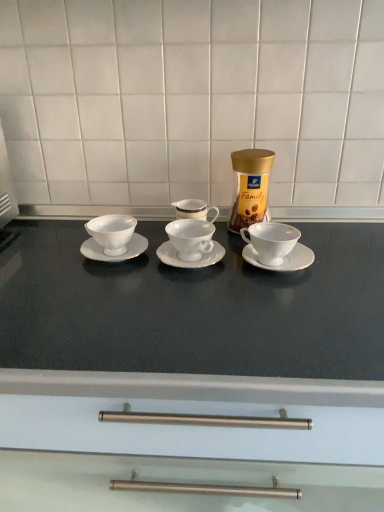
Locate an element on the screen. The width and height of the screenshot is (384, 512). unoccupied region to the right of white porcelain saucer at center, marked as the 2th saucer in a right-to-left arrangement is located at coordinates (284, 266).